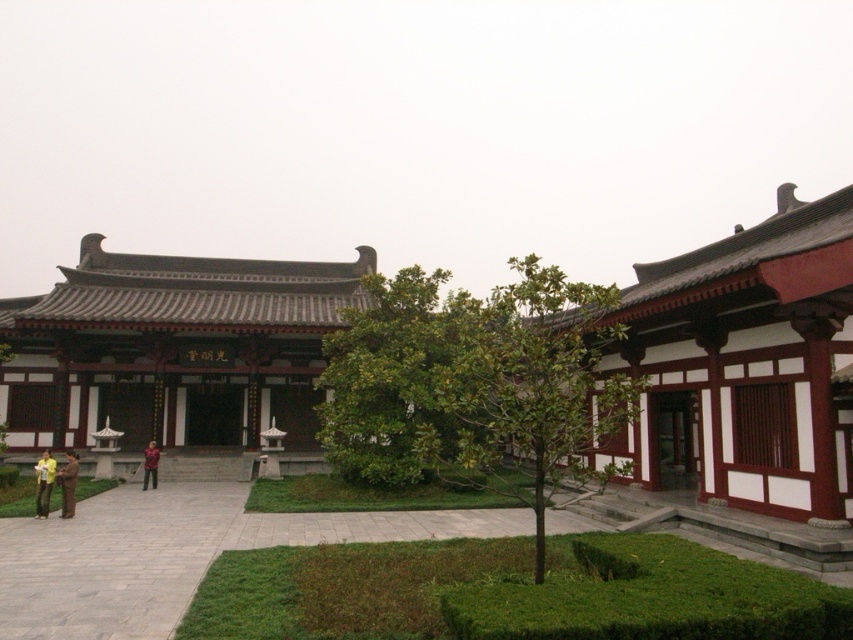
Question: Where is yellow cotton shirt at lower left located in relation to yellow fabric person at lower left in the image?

Choices:
 (A) above
 (B) below

Answer: (B)

Question: Which object is farther from the camera taking this photo?

Choices:
 (A) yellow fabric person at lower left
 (B) gray stone path at center

Answer: (A)

Question: Is white wood palace at right to the left of gray stone path at center from the viewer's perspective?

Choices:
 (A) yes
 (B) no

Answer: (B)

Question: Which object is farther from the camera taking this photo?

Choices:
 (A) white wood palace at right
 (B) gray stone path at center
 (C) yellow fabric person at lower left

Answer: (C)

Question: Is white wood palace at right bigger than gray stone path at center?

Choices:
 (A) yes
 (B) no

Answer: (A)

Question: Which object appears farthest from the camera in this image?

Choices:
 (A) white wood palace at right
 (B) red plaid shirt at center
 (C) yellow fabric person at lower left
 (D) matte brown wooden palace at center

Answer: (D)